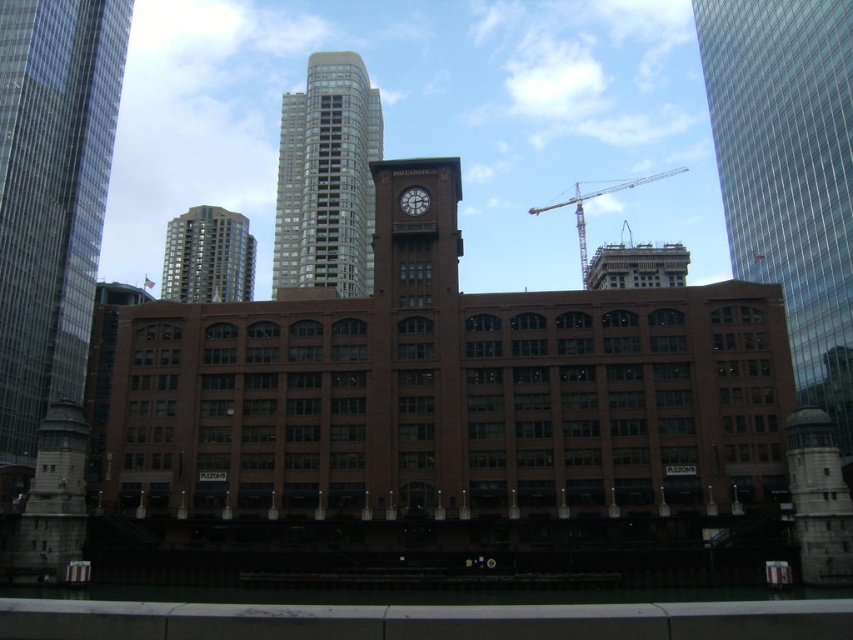
Based on the photo, you are standing at the center of the walkway and want to take a photo of the gold glass tower at upper center. According to the scene description, where should you position yourself to capture the tower in the center of your camera frame?

To capture the gold glass tower at upper center in the center of your camera frame, position yourself at the center of the walkway since the tower is located at coordinates [207,257], which corresponds to the upper center position in the scene.

You are an architect evaluating the urban layout. You need to determine which object occupies more horizontal space in the scene between the glassy reflective skyscraper at right and the matte brown clock at center. Based on the scene, can you identify which one is wider?

The glassy reflective skyscraper at right is wider than the matte brown clock at center, as its width surpasses that of the clock.